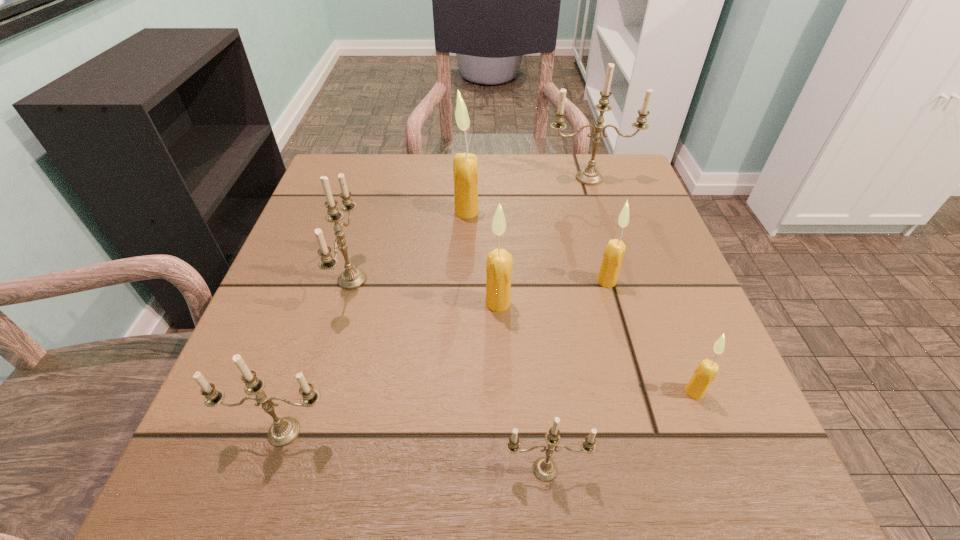
The width and height of the screenshot is (960, 540). What are the coordinates of `free space between the rightmost metallic candle and the rightmost cream candle` in the screenshot? It's located at (641, 285).

The image size is (960, 540). I want to click on free space between the third cream candle from right to left and the seventh nearest candle, so click(482, 258).

Locate which object ranks fifth in proximity to the third nearest candle. Please provide its 2D coordinates. Your answer should be formatted as a tuple, i.e. [(x, y)], where the tuple contains the x and y coordinates of a point satisfying the conditions above.

[(465, 165)]

This screenshot has width=960, height=540. Find the location of `the fifth closest object relative to the second farthest cream candle`. the fifth closest object relative to the second farthest cream candle is located at coordinates (545, 469).

Identify which candle is the fourth nearest to the third biggest cream candle. Please provide its 2D coordinates. Your answer should be formatted as a tuple, i.e. [(x, y)], where the tuple contains the x and y coordinates of a point satisfying the conditions above.

[(590, 176)]

Where is `the fifth closest candle to the smallest metallic candle`? The image size is (960, 540). the fifth closest candle to the smallest metallic candle is located at coordinates [x=352, y=278].

Choose which cream candle is the second nearest neighbor to the farthest candle. Please provide its 2D coordinates. Your answer should be formatted as a tuple, i.e. [(x, y)], where the tuple contains the x and y coordinates of a point satisfying the conditions above.

[(614, 252)]

What are the coordinates of `cream candle that is the third closest to the third cream candle from left to right` in the screenshot? It's located at (465, 165).

Where is `metallic candle that is the second nearest to the leftmost cream candle`? Image resolution: width=960 pixels, height=540 pixels. metallic candle that is the second nearest to the leftmost cream candle is located at coordinates (352, 278).

You are a GUI agent. You are given a task and a screenshot of the screen. Output one action in this format:
    pyautogui.click(x=<x>, y=<y>)
    Task: Click on the third closest metallic candle relative to the third nearest cream candle
    The height and width of the screenshot is (540, 960).
    Given the screenshot: What is the action you would take?
    pyautogui.click(x=352, y=278)